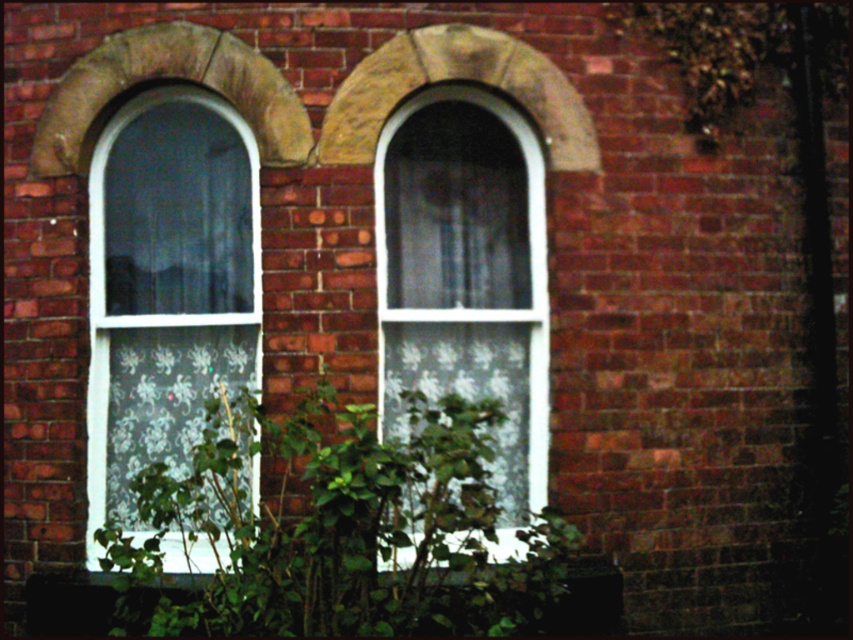
You are standing in front of the two arched windows and notice a green leafy plant at center and a white textured glass at center. Which object is closer to you?

The green leafy plant at center is closer to you because it is in front of the white textured glass at center.

You are standing in front of the brick wall with two arched windows. There is a point marked at coordinates (x=339, y=529). What object is located at this point?

The point at coordinates (x=339, y=529) marks a green leafy plant at center.

You are standing in front of the brick wall with two arched windows. You see a green leafy plant at center and a white textured glass at center. Which object would block more sunlight coming through the windows?

The green leafy plant at center is bigger than the white textured glass at center, so it would block more sunlight coming through the windows.